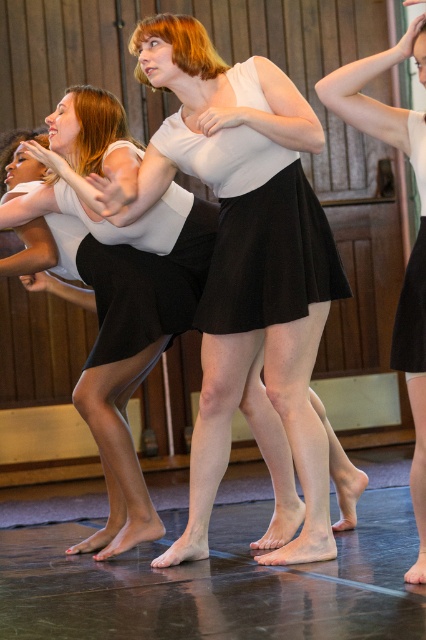
Question: Which point is farther from the camera taking this photo?

Choices:
 (A) (275, 212)
 (B) (397, 365)
 (C) (298, 296)
 (D) (420, 401)

Answer: (A)

Question: Is matte white blouse at center below black satin skirt at center?

Choices:
 (A) no
 (B) yes

Answer: (A)

Question: Which of these objects is positioned farthest from the matte white blouse at center?

Choices:
 (A) black pleated skirt at center
 (B) black satin skirt at center
 (C) white matte skirt at center

Answer: (C)

Question: From the image, what is the correct spatial relationship of white matte skirt at center in relation to black pleated skirt at center?

Choices:
 (A) right
 (B) left

Answer: (B)

Question: From the image, what is the correct spatial relationship of white matte skirt at center in relation to black pleated skirt at center?

Choices:
 (A) right
 (B) left

Answer: (B)

Question: Which point is closer to the camera?

Choices:
 (A) black pleated skirt at center
 (B) black satin skirt at center

Answer: (B)